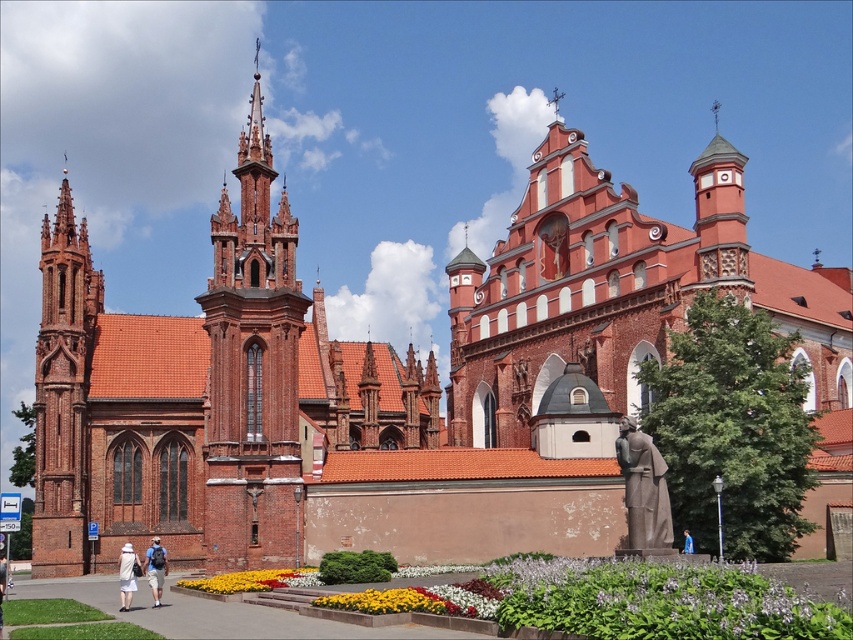
Question: Which object is farther from the camera taking this photo?

Choices:
 (A) red brick church at center
 (B) yellow fabric flower at center
 (C) bronze statue at lower right

Answer: (A)

Question: Which point is farther to the camera?

Choices:
 (A) bronze statue at lower right
 (B) red brick church at center
 (C) yellow fabric flower at center

Answer: (B)

Question: Which of the following is the farthest from the observer?

Choices:
 (A) (241, 376)
 (B) (364, 604)

Answer: (A)

Question: Does light brown backpack at lower left come in front of white cotton dress at lower left?

Choices:
 (A) yes
 (B) no

Answer: (B)

Question: Can you confirm if red brick church at center is thinner than white cotton dress at lower left?

Choices:
 (A) no
 (B) yes

Answer: (A)

Question: Is yellow fabric flower at center bigger than light brown backpack at lower left?

Choices:
 (A) yes
 (B) no

Answer: (B)